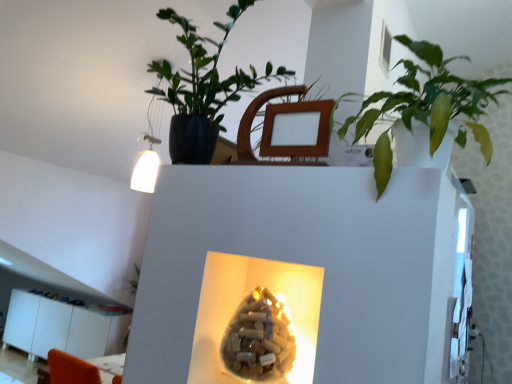
Describe the element at coordinates (259, 339) in the screenshot. I see `translucent beige vase at center` at that location.

Describe the element at coordinates (272, 128) in the screenshot. I see `wooden swivel chair at upper center` at that location.

This screenshot has height=384, width=512. I want to click on wooden swivel chair at upper center, so click(272, 128).

What do you see at coordinates (426, 105) in the screenshot? The image size is (512, 384). I see `green glossy leafy plant at upper right, marked as the second houseplant in a left-to-right arrangement` at bounding box center [426, 105].

The height and width of the screenshot is (384, 512). I want to click on translucent beige vase at center, so click(x=259, y=339).

From the image's perspective, relative to translucent beige vase at center, is white glossy cabinet at lower left above or below?

white glossy cabinet at lower left is situated lower than translucent beige vase at center in the image.

Consider the image. Which of these two, white glossy cabinet at lower left or translucent beige vase at center, stands taller?

white glossy cabinet at lower left is taller.

Which point is more forward, (70, 328) or (231, 350)?

The point (231, 350) is in front.

Based on their sizes in the image, would you say white glossy cabinet at lower left is bigger or smaller than translucent beige vase at center?

Considering their sizes, white glossy cabinet at lower left takes up more space than translucent beige vase at center.

Consider the image. Is wooden swivel chair at upper center inside or outside of green glossy leafy plant at upper right, which is the first houseplant from right to left?

wooden swivel chair at upper center is outside green glossy leafy plant at upper right, which is the first houseplant from right to left.

Considering the relative sizes of wooden swivel chair at upper center and green glossy leafy plant at upper right, which is the first houseplant from right to left, in the image provided, is wooden swivel chair at upper center taller than green glossy leafy plant at upper right, which is the first houseplant from right to left,?

No, wooden swivel chair at upper center is not taller than green glossy leafy plant at upper right, which is the first houseplant from right to left.

Who is smaller, wooden swivel chair at upper center or green glossy leafy plant at upper right, which is the first houseplant from right to left?

With smaller size is wooden swivel chair at upper center.

Measure the distance between wooden swivel chair at upper center and green glossy leafy plant at upper right, marked as the second houseplant in a left-to-right arrangement.

They are 29.22 centimeters apart.

Looking at this image, is the position of white glossy cabinet at lower left more distant than that of matte black pot at upper center, the first houseplant when ordered from left to right?

Yes, it is.

From a real-world perspective, is white glossy cabinet at lower left located higher than matte black pot at upper center, the first houseplant when ordered from left to right?

No.

Are white glossy cabinet at lower left and matte black pot at upper center, which appears as the second houseplant when viewed from the right, making contact?

white glossy cabinet at lower left is not next to matte black pot at upper center, which appears as the second houseplant when viewed from the right, and they're not touching.

Could you tell me if green glossy leafy plant at upper right, which is the first houseplant from right to left, is turned towards white glossy cabinet at lower left?

No, green glossy leafy plant at upper right, which is the first houseplant from right to left, is not turned towards white glossy cabinet at lower left.

From the image's perspective, is green glossy leafy plant at upper right, which is the first houseplant from right to left, beneath white glossy cabinet at lower left?

No, from the image's perspective, green glossy leafy plant at upper right, which is the first houseplant from right to left, is not beneath white glossy cabinet at lower left.

Measure the distance between green glossy leafy plant at upper right, marked as the second houseplant in a left-to-right arrangement, and white glossy cabinet at lower left.

They are 3.94 meters apart.

Which is more to the left, green glossy leafy plant at upper right, marked as the second houseplant in a left-to-right arrangement, or white glossy cabinet at lower left?

Positioned to the left is white glossy cabinet at lower left.

Is point (264, 308) closer to camera compared to point (426, 119)?

No, (264, 308) is behind (426, 119).

How many degrees apart are the facing directions of translucent beige vase at center and green glossy leafy plant at upper right, which is the first houseplant from right to left?

87.4 degrees.

Is green glossy leafy plant at upper right, which is the first houseplant from right to left, a part of translucent beige vase at center?

No, green glossy leafy plant at upper right, which is the first houseplant from right to left, is located outside of translucent beige vase at center.

Is translucent beige vase at center placed right next to green glossy leafy plant at upper right, which is the first houseplant from right to left?

translucent beige vase at center is not next to green glossy leafy plant at upper right, which is the first houseplant from right to left, and they're not touching.

Which is closer, (251, 70) or (460, 126)?

The point (460, 126) is in front.

From a real-world perspective, between matte black pot at upper center, which appears as the second houseplant when viewed from the right, and green glossy leafy plant at upper right, marked as the second houseplant in a left-to-right arrangement, who is vertically higher?

matte black pot at upper center, which appears as the second houseplant when viewed from the right.

You are a GUI agent. You are given a task and a screenshot of the screen. Output one action in this format:
    pyautogui.click(x=<x>, y=<y>)
    Task: Click on the houseplant to the left of green glossy leafy plant at upper right, which is the first houseplant from right to left
    This screenshot has width=512, height=384.
    Given the screenshot: What is the action you would take?
    pyautogui.click(x=202, y=88)

Can you confirm if white glossy cabinet at lower left is taller than wooden swivel chair at upper center?

Indeed, white glossy cabinet at lower left has a greater height compared to wooden swivel chair at upper center.

In the scene shown: Is white glossy cabinet at lower left completely or partially outside of wooden swivel chair at upper center?

Yes.

From a real-world perspective, relative to wooden swivel chair at upper center, is white glossy cabinet at lower left vertically above or below?

In terms of real-world spatial position, white glossy cabinet at lower left is below wooden swivel chair at upper center.

At what (x,y) coordinates should I click in order to perform the action: click on furniture on the left of translucent beige vase at center. Please return your answer as a coordinate pair (x, y). The height and width of the screenshot is (384, 512). Looking at the image, I should click on tap(61, 328).

The height and width of the screenshot is (384, 512). I want to click on houseplant that is below the wooden swivel chair at upper center (from the image's perspective), so click(426, 105).

Considering their positions, is wooden swivel chair at upper center positioned further to translucent beige vase at center than matte black pot at upper center, the first houseplant when ordered from left to right?

matte black pot at upper center, the first houseplant when ordered from left to right, is further to translucent beige vase at center.

From the image, which object appears to be nearer to white glossy cabinet at lower left, matte black pot at upper center, which appears as the second houseplant when viewed from the right, or translucent beige vase at center?

matte black pot at upper center, which appears as the second houseplant when viewed from the right, is positioned closer to the anchor white glossy cabinet at lower left.

Which object lies nearer to the anchor point wooden swivel chair at upper center, translucent beige vase at center or matte black pot at upper center, which appears as the second houseplant when viewed from the right?

Among the two, matte black pot at upper center, which appears as the second houseplant when viewed from the right, is located nearer to wooden swivel chair at upper center.

Considering their positions, is translucent beige vase at center positioned closer to white glossy cabinet at lower left than green glossy leafy plant at upper right, marked as the second houseplant in a left-to-right arrangement?

translucent beige vase at center is closer to white glossy cabinet at lower left.

Looking at this image, which object lies nearer to the anchor point matte black pot at upper center, the first houseplant when ordered from left to right, wooden swivel chair at upper center or white glossy cabinet at lower left?

wooden swivel chair at upper center lies closer to matte black pot at upper center, the first houseplant when ordered from left to right, than the other object.

Looking at the image, which one is located further to green glossy leafy plant at upper right, which is the first houseplant from right to left, translucent beige vase at center or matte black pot at upper center, the first houseplant when ordered from left to right?

The object further to green glossy leafy plant at upper right, which is the first houseplant from right to left, is matte black pot at upper center, the first houseplant when ordered from left to right.

Based on their spatial positions, is green glossy leafy plant at upper right, which is the first houseplant from right to left, or wooden swivel chair at upper center closer to translucent beige vase at center?

Based on the image, wooden swivel chair at upper center appears to be nearer to translucent beige vase at center.

Based on the photo, from the image, which object appears to be farther from matte black pot at upper center, which appears as the second houseplant when viewed from the right, white glossy cabinet at lower left or translucent beige vase at center?

white glossy cabinet at lower left lies further to matte black pot at upper center, which appears as the second houseplant when viewed from the right, than the other object.

Image resolution: width=512 pixels, height=384 pixels. In order to click on swivel chair between matte black pot at upper center, the first houseplant when ordered from left to right, and green glossy leafy plant at upper right, which is the first houseplant from right to left, in the horizontal direction in this screenshot , I will do `click(272, 128)`.

I want to click on houseplant between wooden swivel chair at upper center and translucent beige vase at center in the vertical direction, so click(x=426, y=105).

Image resolution: width=512 pixels, height=384 pixels. In order to click on swivel chair between translucent beige vase at center and white glossy cabinet at lower left from front to back in this screenshot , I will do `click(272, 128)`.

Where is `flower located between green glossy leafy plant at upper right, marked as the second houseplant in a left-to-right arrangement, and white glossy cabinet at lower left in the depth direction`? Image resolution: width=512 pixels, height=384 pixels. flower located between green glossy leafy plant at upper right, marked as the second houseplant in a left-to-right arrangement, and white glossy cabinet at lower left in the depth direction is located at coordinates (259, 339).